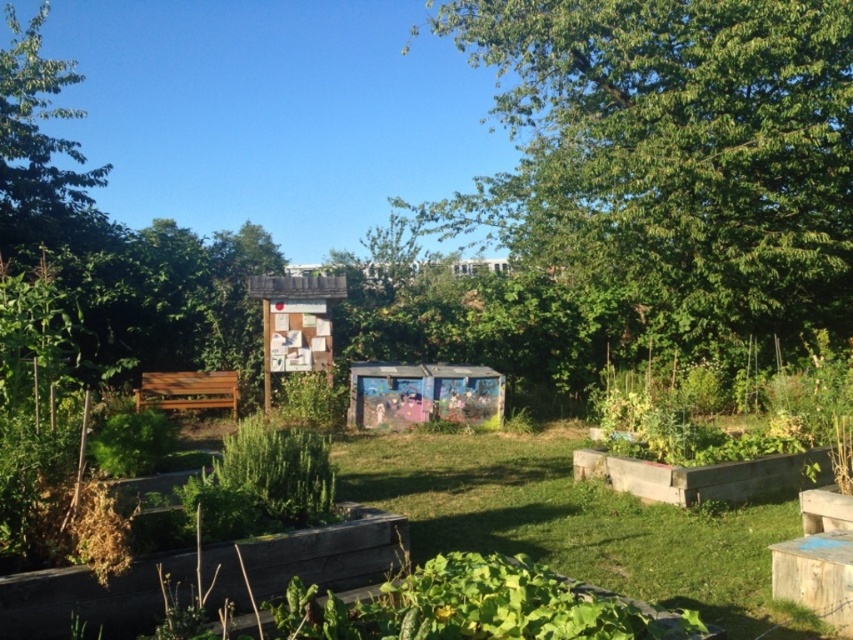
Based on the photo, you are standing in the garden and want to walk directly toward the green leafy tree at upper center. Which direction should you walk to avoid passing by the green leafy tree at upper left?

Since the green leafy tree at upper center is closer to the viewer than the green leafy tree at upper left, you should walk straight ahead toward the center to reach the closer tree without passing by the one on the left.